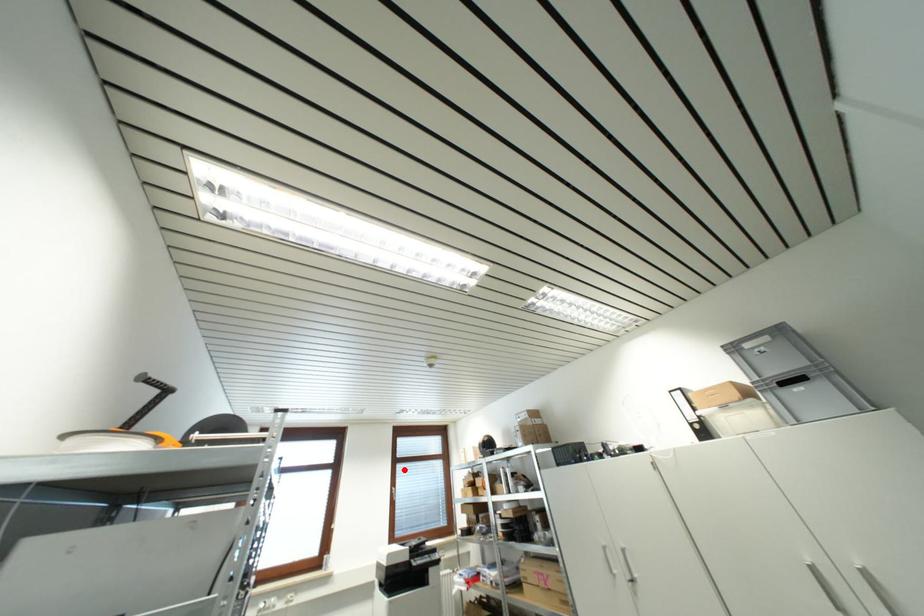
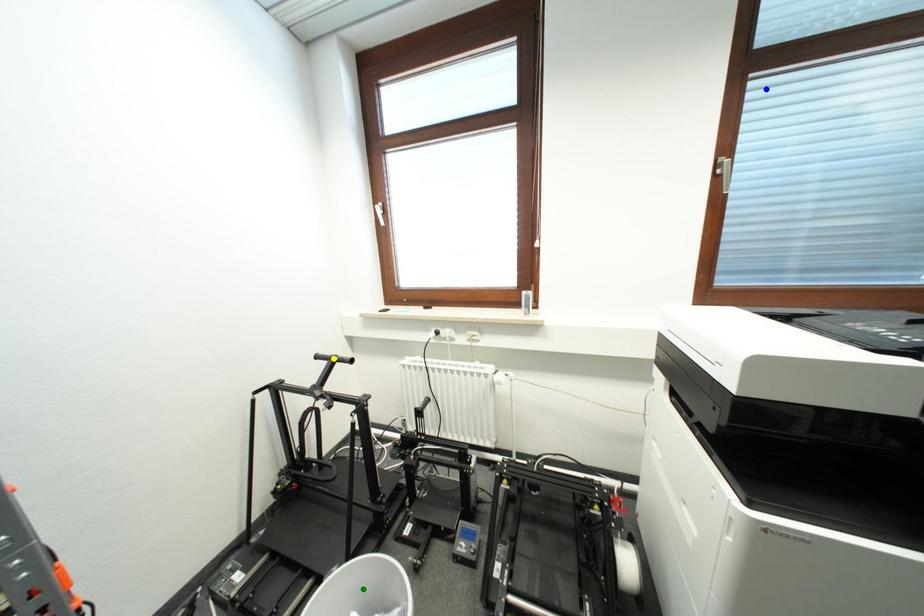
Question: I am providing you with two images of the same scene from different viewpoints. A red point is marked on the first image. You are given multiple points on the second image. Which spot in image 2 lines up with the point in image 1?

Choices:
 (A) yellow point
 (B) blue point
 (C) green point

Answer: (B)